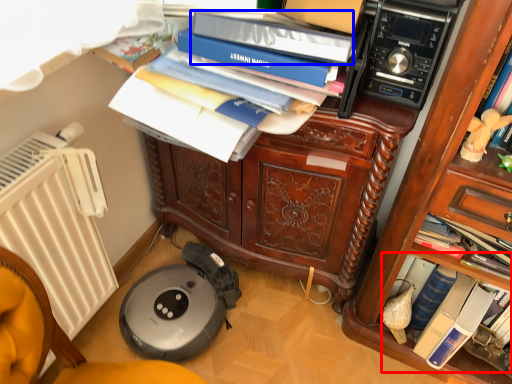
Question: Which object appears closest to the camera in this image, book (highlighted by a red box) or bin (highlighted by a blue box)?

Choices:
 (A) book
 (B) bin

Answer: (B)